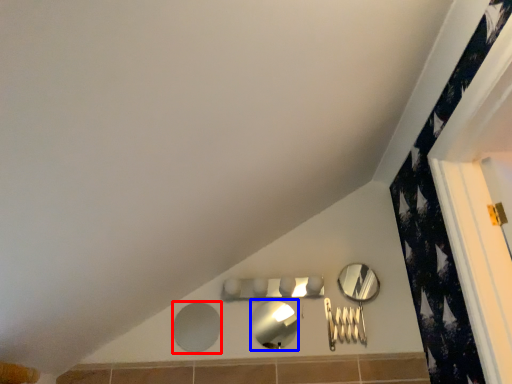
Question: Which point is closer to the camera, mirror (highlighted by a red box) or mirror (highlighted by a blue box)?

Choices:
 (A) mirror
 (B) mirror

Answer: (B)